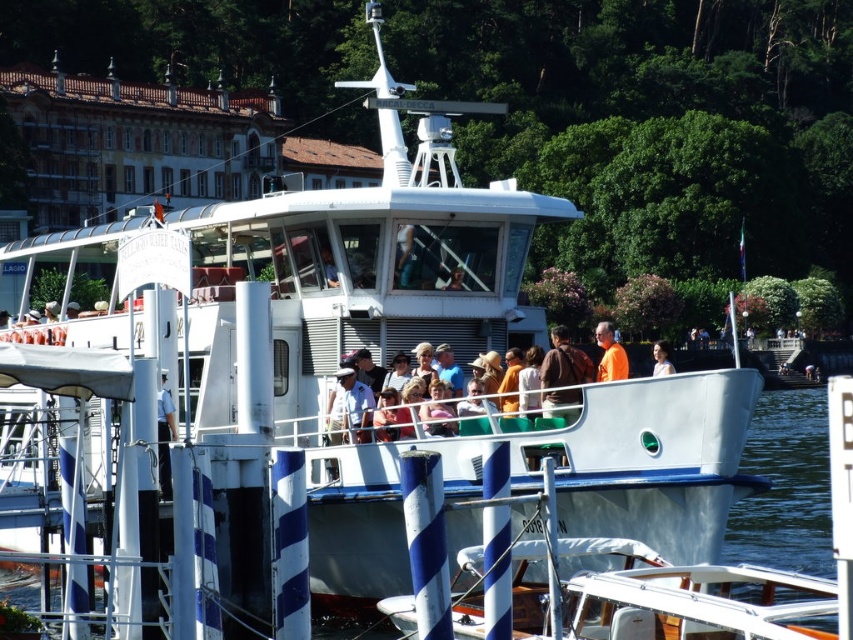
Does brown leather jacket at center appear under orange fabric shirt at center?

Correct, brown leather jacket at center is located below orange fabric shirt at center.

Consider the image. Measure the distance between point (x=550, y=362) and camera.

A distance of 170.61 feet exists between point (x=550, y=362) and camera.

Is point (578, 371) positioned before point (608, 360)?

Yes, it is in front of point (608, 360).

Locate an element on the screen. The height and width of the screenshot is (640, 853). brown leather jacket at center is located at coordinates (563, 376).

Is point (170, 416) closer to viewer compared to point (656, 349)?

Yes, it is in front of point (656, 349).

Find the location of `light blue uniform at center`. light blue uniform at center is located at coordinates (164, 436).

Find the location of a particular element. The height and width of the screenshot is (640, 853). light blue uniform at center is located at coordinates (164, 436).

Which is more to the left, brown leather jacket at center or light blue uniform at center?

light blue uniform at center is more to the left.

Between brown leather jacket at center and light blue uniform at center, which one is positioned higher?

brown leather jacket at center is above.

Which is in front, point (581, 376) or point (165, 412)?

Point (581, 376) is in front.

You are a GUI agent. You are given a task and a screenshot of the screen. Output one action in this format:
    pyautogui.click(x=<x>, y=<y>)
    Task: Click on the brown leather jacket at center
    This screenshot has height=640, width=853.
    Given the screenshot: What is the action you would take?
    pyautogui.click(x=563, y=376)